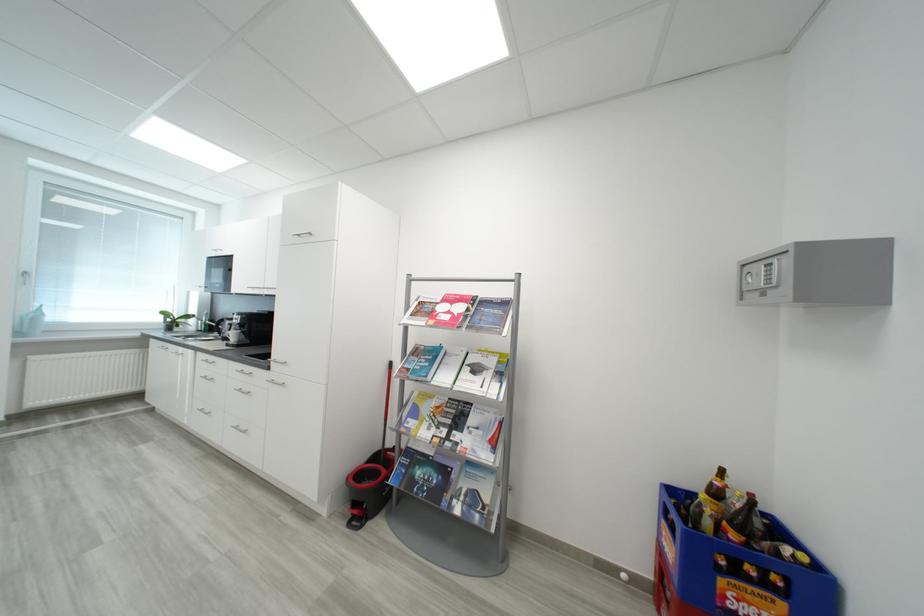
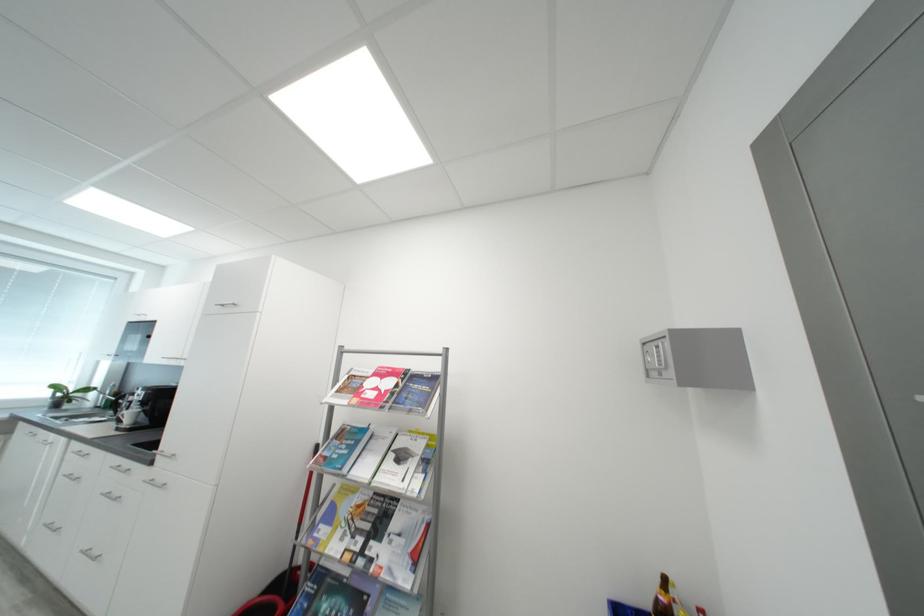
Where in the second image is the point corresponding to [464,438] from the first image?

(380, 549)